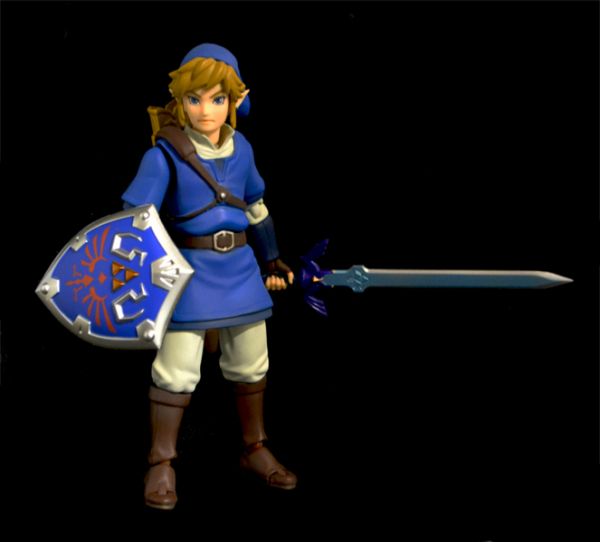
Identify the location of handle. (309, 285).